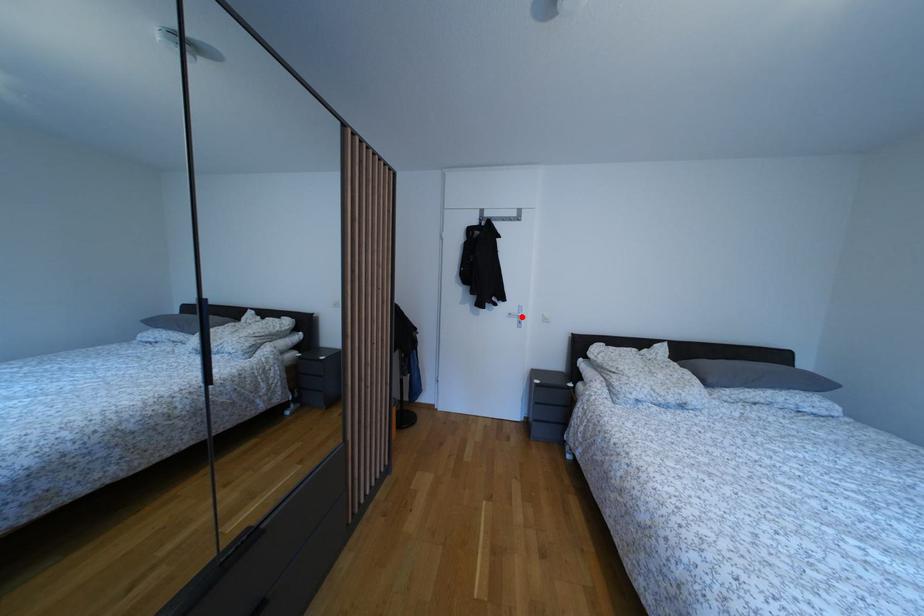
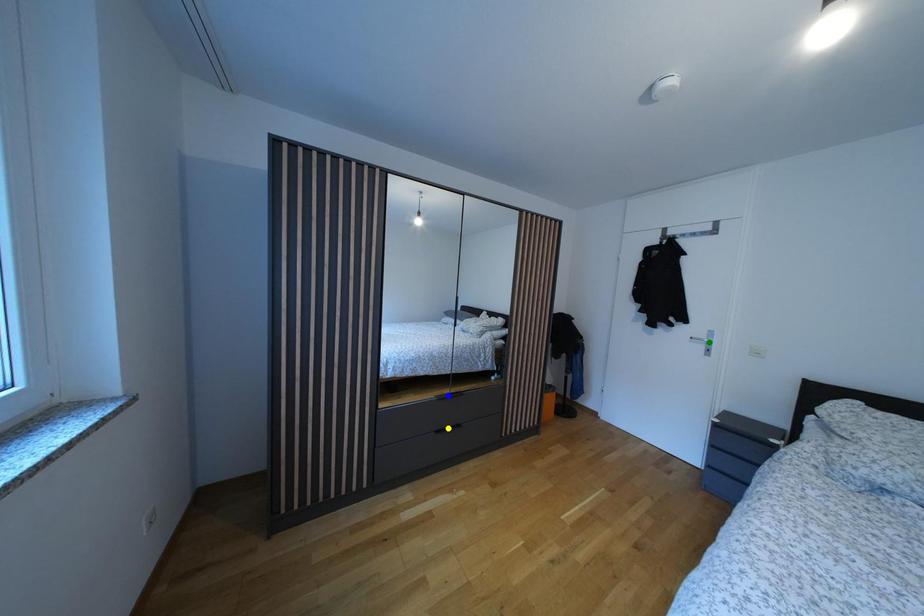
Question: I am providing you with two images of the same scene from different viewpoints. A red point is marked on the first image. You are given multiple points on the second image. In image 2, which mark is for the same physical point as the one in image 1?

Choices:
 (A) yellow point
 (B) green point
 (C) blue point

Answer: (B)